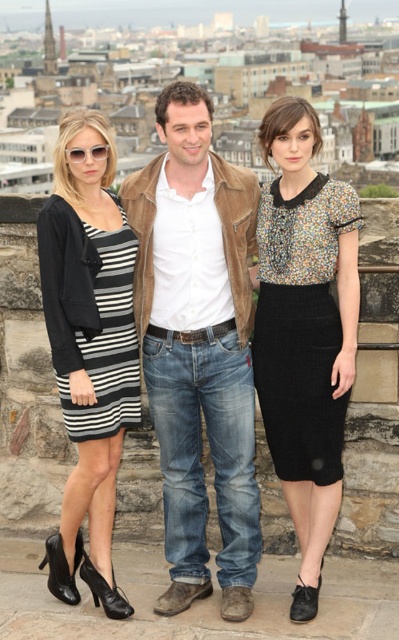
Which is behind, point (96, 113) or point (343, 420)?

Point (96, 113)

Between point (102, 449) and point (266, 348), which one is positioned behind?

Point (266, 348)

Locate an element on the screen. striped fabric dress at left is located at coordinates (88, 353).

Is multicolored knit top at center further to the viewer compared to matte black sunglasses at upper left?

No, it is not.

Is multicolored knit top at center above matte black sunglasses at upper left?

Actually, multicolored knit top at center is below matte black sunglasses at upper left.

What are the coordinates of `multicolored knit top at center` in the screenshot? It's located at (300, 326).

At what (x,y) coordinates should I click in order to perform the action: click on multicolored knit top at center. Please return your answer as a coordinate pair (x, y). Looking at the image, I should click on (300, 326).

Does point (197, 378) come closer to viewer compared to point (86, 148)?

That is False.

Is striped cotton dress at center taller than matte black sunglasses at upper left?

Correct, striped cotton dress at center is much taller as matte black sunglasses at upper left.

The height and width of the screenshot is (640, 399). I want to click on striped cotton dress at center, so click(199, 346).

The height and width of the screenshot is (640, 399). What are the coordinates of `striped cotton dress at center` in the screenshot? It's located at (199, 346).